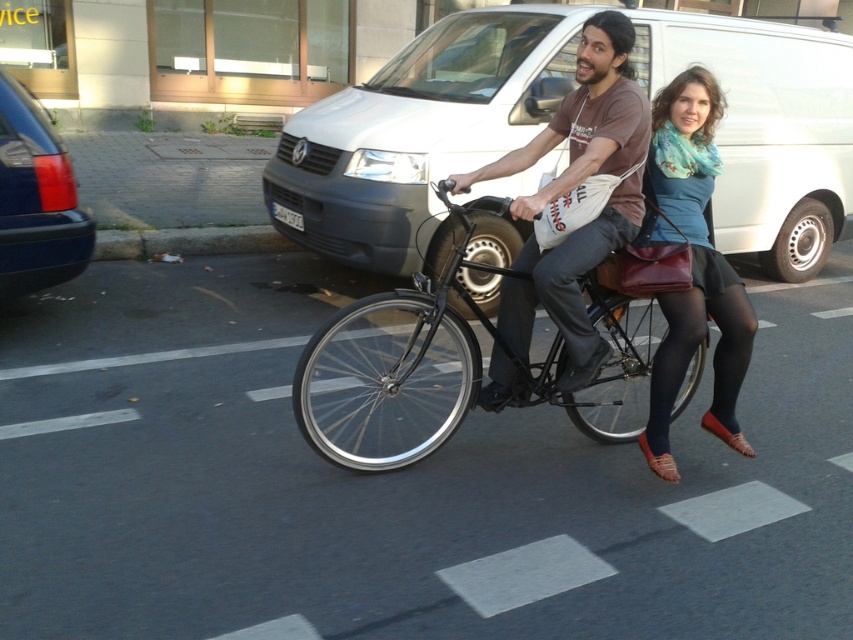
You are a pedestrian standing in the middle of the street. You see the shiny black bicycle at center and the metallic blue car at left. Which one is nearer to you?

The shiny black bicycle at center is closer to the viewer than the metallic blue car at left, so the bicycle is nearer.

You are a photographer standing on the sidewalk. You want to take a photo of the blue jersey at center and the white matte van at center in the same frame. Which object should you focus on first to ensure both are in focus?

The white matte van at center is taller than the blue jersey at center, so you should focus on the white matte van at center first to ensure both are in focus.